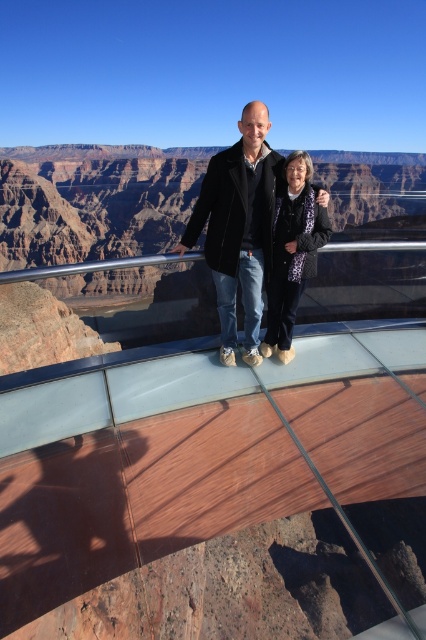
Question: Is matte black coat at center to the right of patterned fabric coat at center from the viewer's perspective?

Choices:
 (A) yes
 (B) no

Answer: (B)

Question: Where is matte black coat at center located in relation to patterned fabric coat at center in the image?

Choices:
 (A) above
 (B) below

Answer: (B)

Question: Which object is closer to the camera taking this photo?

Choices:
 (A) matte black coat at center
 (B) patterned fabric coat at center

Answer: (A)

Question: Which of the following is the farthest from the observer?

Choices:
 (A) patterned fabric coat at center
 (B) matte black coat at center

Answer: (A)

Question: Does matte black coat at center appear on the left side of patterned fabric coat at center?

Choices:
 (A) no
 (B) yes

Answer: (B)

Question: Which point is farther to the camera?

Choices:
 (A) (290, 305)
 (B) (325, 204)

Answer: (A)